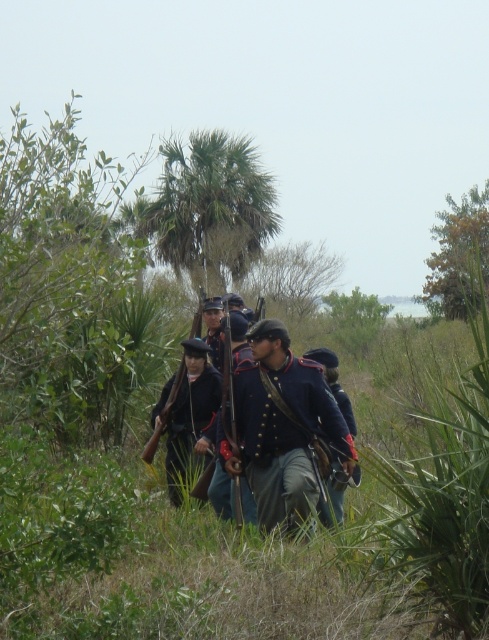
Question: Among these objects, which one is farthest from the camera?

Choices:
 (A) green leafy palm tree at center
 (B) blue uniformed soldiers at center
 (C) blue woolen coat at center

Answer: (A)

Question: Which point is closer to the camera?

Choices:
 (A) (307, 396)
 (B) (338, 388)
 (C) (199, 388)
 (D) (196, 288)

Answer: (A)

Question: Is dark blue wool uniform at center to the left of blue wool uniform at center from the viewer's perspective?

Choices:
 (A) yes
 (B) no

Answer: (A)

Question: Which point is closer to the camera?

Choices:
 (A) (209, 147)
 (B) (220, 456)
 (C) (321, 499)
 (D) (262, 508)

Answer: (C)

Question: Observing the image, what is the correct spatial positioning of blue uniformed soldiers at center in reference to blue woolen coat at center?

Choices:
 (A) right
 (B) left

Answer: (B)

Question: Is green leafy palm tree at center further to the viewer compared to dark blue wool uniform at center?

Choices:
 (A) yes
 (B) no

Answer: (A)